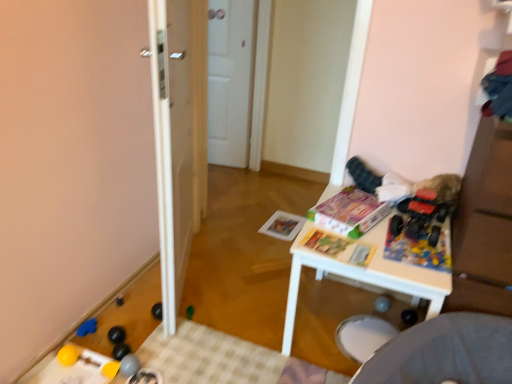
Where is `free area in between rubberized plastic toy at center right, which appears as the first toy when viewed from the top, and matte cardboard magazine at center, placed as the second magazine when sorted from front to back`? Image resolution: width=512 pixels, height=384 pixels. free area in between rubberized plastic toy at center right, which appears as the first toy when viewed from the top, and matte cardboard magazine at center, placed as the second magazine when sorted from front to back is located at coordinates (381, 236).